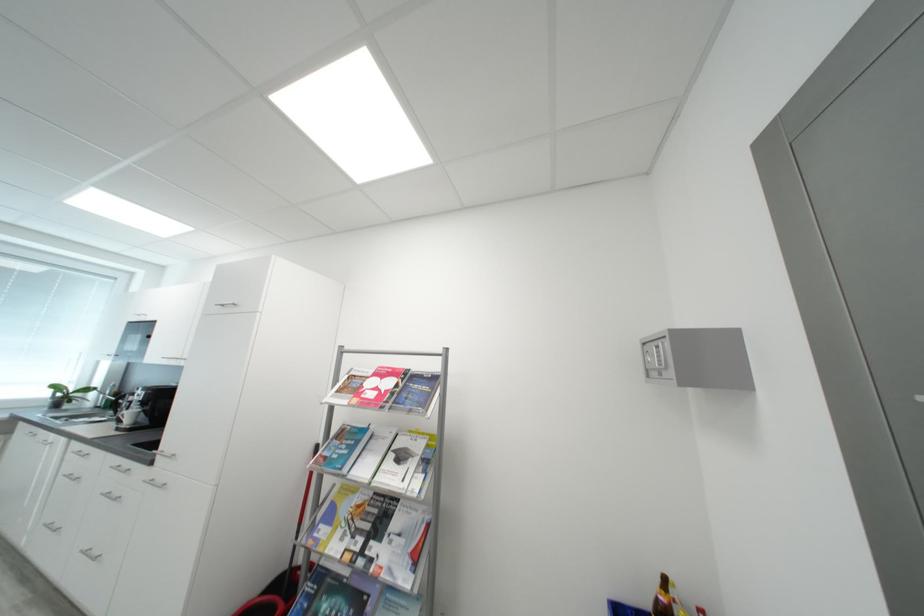
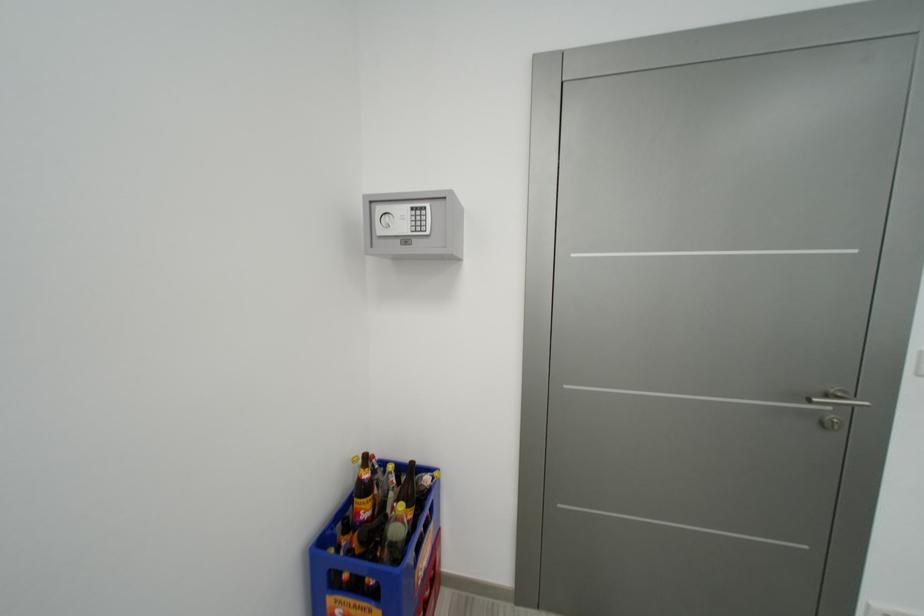
Question: The images are taken continuously from a first-person perspective. In which direction is your viewpoint rotating?

Choices:
 (A) Left
 (B) Right
 (C) Up
 (D) Down

Answer: (B)